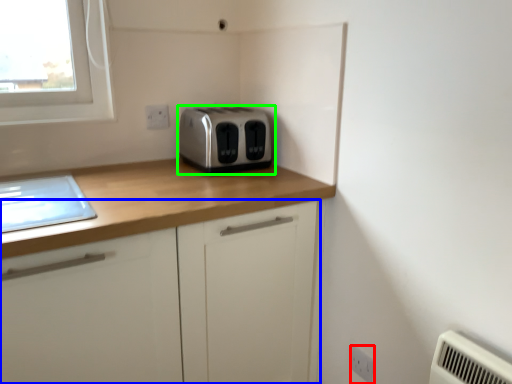
Question: Considering the real-world distances, which object is farthest from electric outlet (highlighted by a red box)? cabinetry (highlighted by a blue box) or toaster (highlighted by a green box)?

Choices:
 (A) cabinetry
 (B) toaster

Answer: (B)